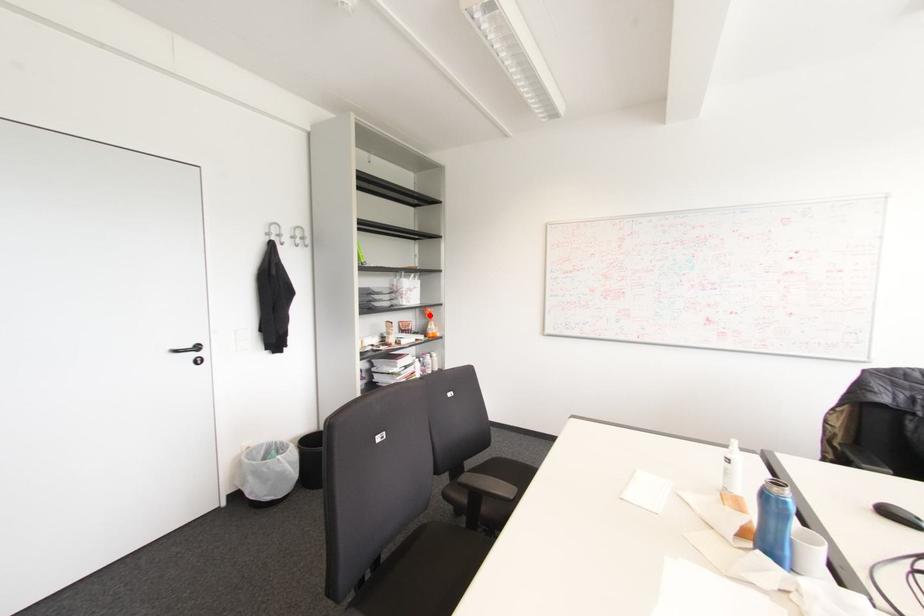
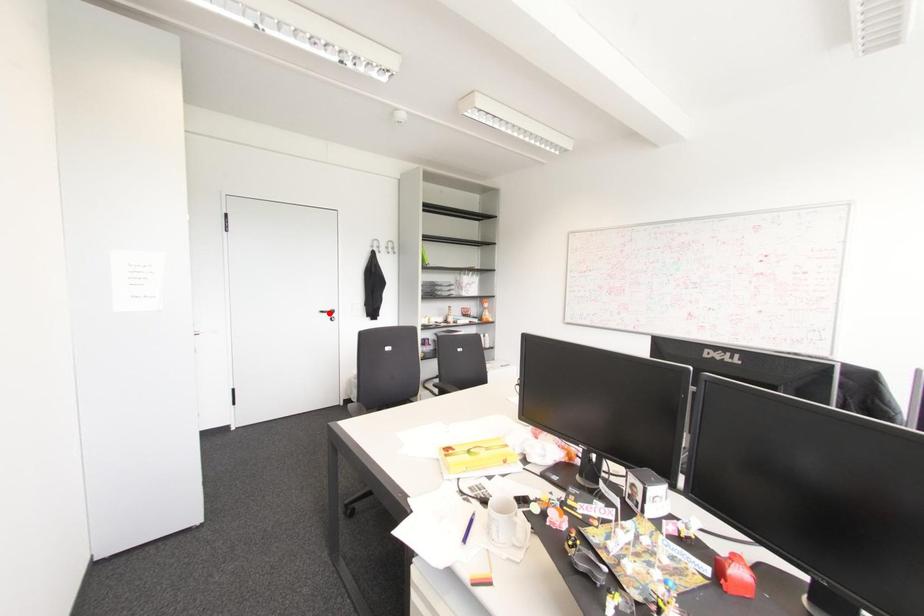
I am providing you with two images of the same scene from different viewpoints. A red point is marked on the first image and another point is marked on the second image. Does the point marked in image1 correspond to the same location as the one in image2?

No